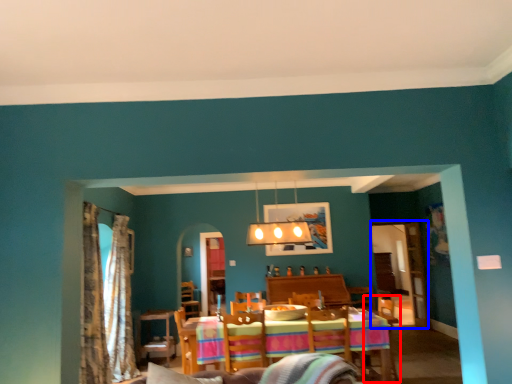
Question: Which of the following is the closest to the observer, armchair (highlighted by a red box) or glass door (highlighted by a blue box)?

Choices:
 (A) armchair
 (B) glass door

Answer: (A)